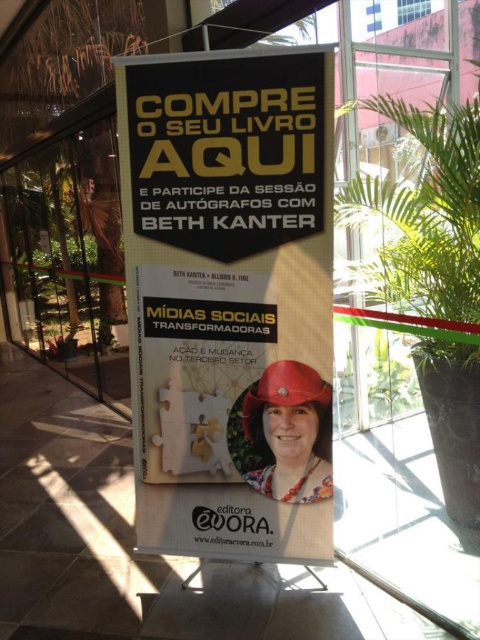
Does black paper poster at center have a greater height compared to matte red helmet at center?

Yes, black paper poster at center is taller than matte red helmet at center.

Is black paper poster at center positioned in front of matte red helmet at center?

Yes, it is.

Between point (207, 141) and point (271, 403), which one is positioned behind?

The point (271, 403) is behind.

I want to click on black paper poster at center, so click(229, 300).

Is green leafy plant at center in front of matte red helmet at center?

No, it is not.

Is green leafy plant at center bigger than matte red helmet at center?

Correct, green leafy plant at center is larger in size than matte red helmet at center.

Is point (475, 294) positioned behind point (319, 374)?

Yes, point (475, 294) is farther from viewer.

Find the location of a particular element. green leafy plant at center is located at coordinates (428, 225).

Can you confirm if black paper poster at center is shorter than green leafy plant at center?

In fact, black paper poster at center may be taller than green leafy plant at center.

Consider the image. Which of these two, black paper poster at center or green leafy plant at center, stands shorter?

Result: With less height is green leafy plant at center.

You are a GUI agent. You are given a task and a screenshot of the screen. Output one action in this format:
    pyautogui.click(x=<x>, y=<y>)
    Task: Click on the black paper poster at center
    This screenshot has width=480, height=640.
    Given the screenshot: What is the action you would take?
    pyautogui.click(x=229, y=300)